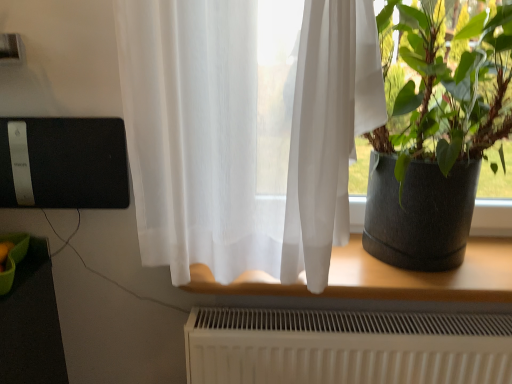
Question: Considering their positions, is translucent fabric at center located in front of or behind dark gray textured pot at right?

Choices:
 (A) behind
 (B) front

Answer: (A)

Question: In terms of width, does translucent fabric at center look wider or thinner when compared to dark gray textured pot at right?

Choices:
 (A) thin
 (B) wide

Answer: (A)

Question: In terms of height, does translucent fabric at center look taller or shorter compared to dark gray textured pot at right?

Choices:
 (A) tall
 (B) short

Answer: (B)

Question: Do you think dark gray textured pot at right is within translucent fabric at center, or outside of it?

Choices:
 (A) outside
 (B) inside

Answer: (A)

Question: Considering their positions, is dark gray textured pot at right located in front of or behind translucent fabric at center?

Choices:
 (A) front
 (B) behind

Answer: (A)

Question: From the image's perspective, is dark gray textured pot at right above or below translucent fabric at center?

Choices:
 (A) below
 (B) above

Answer: (B)

Question: Based on their sizes in the image, would you say dark gray textured pot at right is bigger or smaller than translucent fabric at center?

Choices:
 (A) big
 (B) small

Answer: (A)